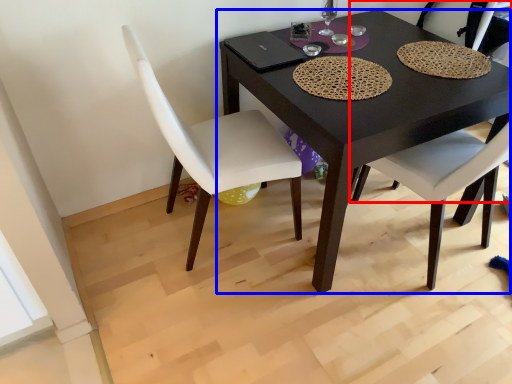
Question: Which object appears closest to the camera in this image, chair (highlighted by a red box) or table (highlighted by a blue box)?

Choices:
 (A) chair
 (B) table

Answer: (B)